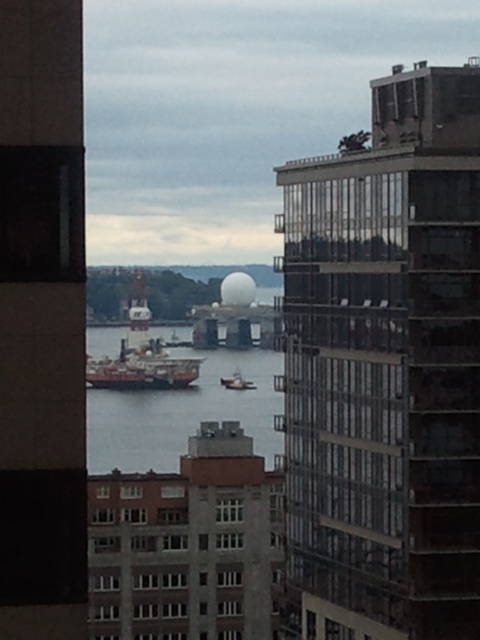
You are standing on the balcony of the tall building in the foreground. You want to locate the shiny metallic ship at center. Based on the coordinates provided, in which direction should you look relative to your position?

The shiny metallic ship at center is located at coordinates point (142,369). Since the coordinates are relative to the image, you should look towards the center of the image to find it.